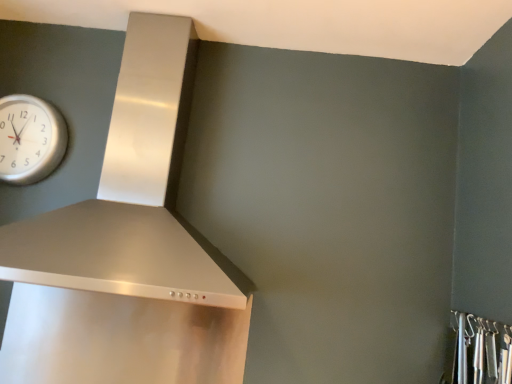
Where is `empty space that is ontop of silver metallic clock at upper left (from a real-world perspective)`? This screenshot has width=512, height=384. empty space that is ontop of silver metallic clock at upper left (from a real-world perspective) is located at coordinates (34, 92).